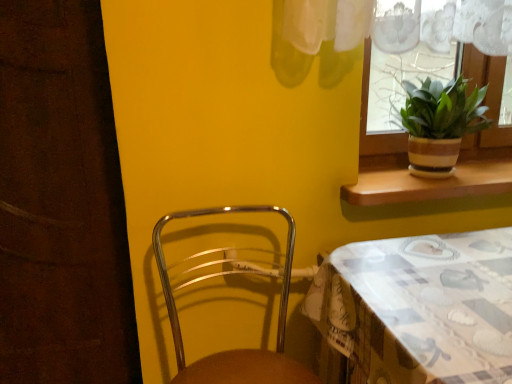
Where is `empty space that is ontop of brown wood at upper right`? empty space that is ontop of brown wood at upper right is located at coordinates (439, 177).